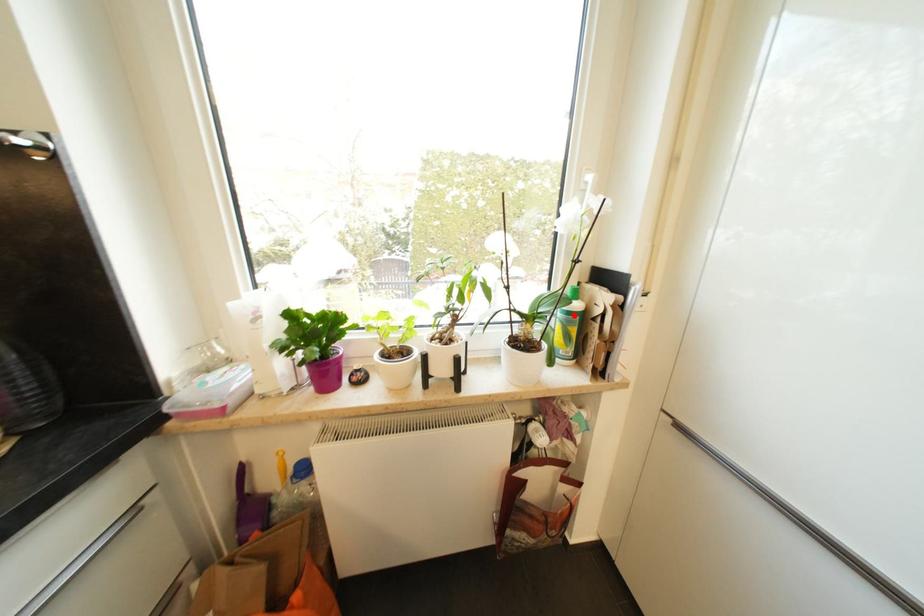
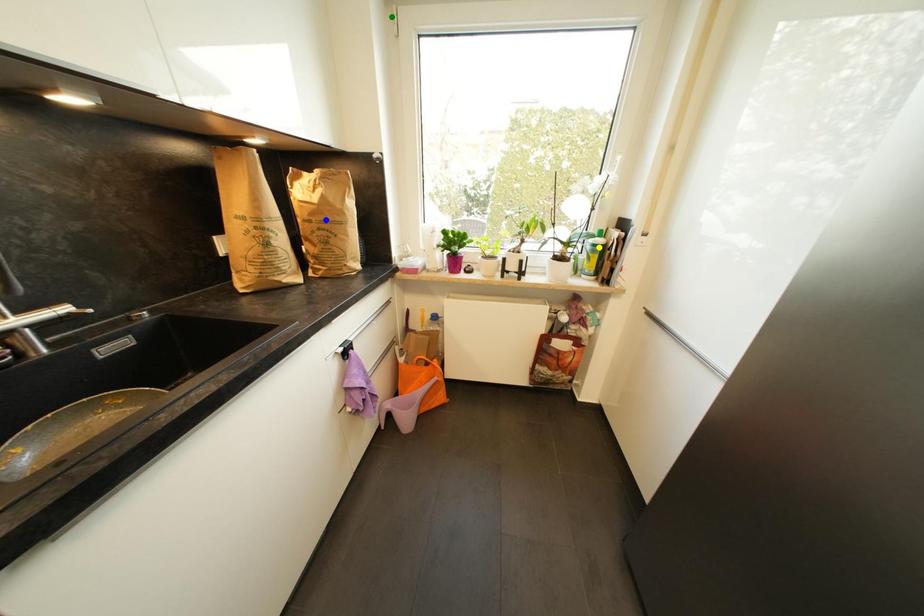
Question: I am providing you with two images of the same scene from different viewpoints. A red point is marked on the first image. You are given multiple points on the second image. Which mark in image 2 goes with the point in image 1?

Choices:
 (A) yellow point
 (B) blue point
 (C) green point

Answer: (A)